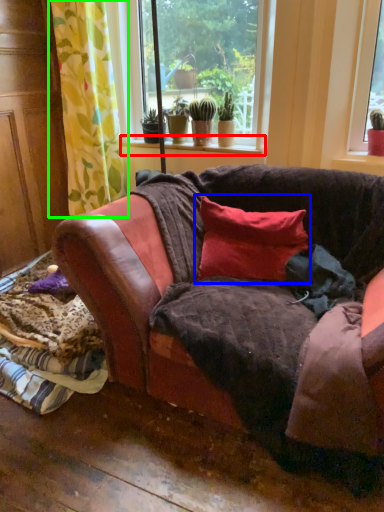
Question: Which object is the closest to the window sill (highlighted by a red box)? Choose among these: pillow (highlighted by a blue box) or curtain (highlighted by a green box).

Choices:
 (A) pillow
 (B) curtain

Answer: (B)